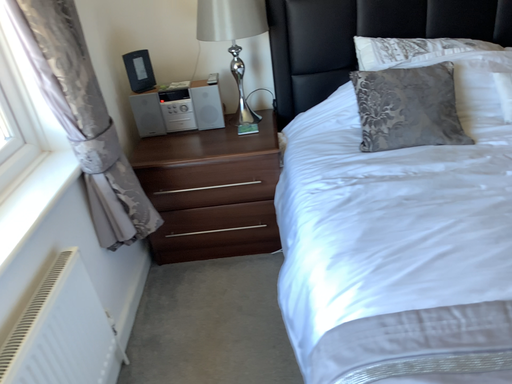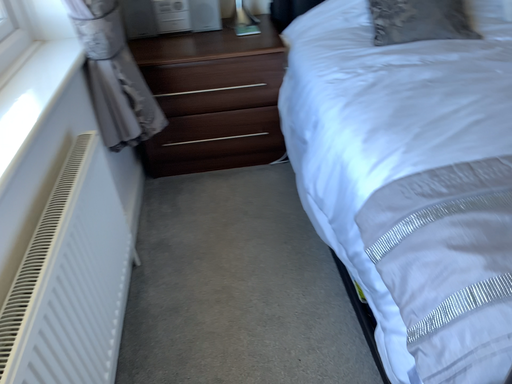
Question: How did the camera likely rotate when shooting the video?

Choices:
 (A) rotated left
 (B) rotated right

Answer: (B)